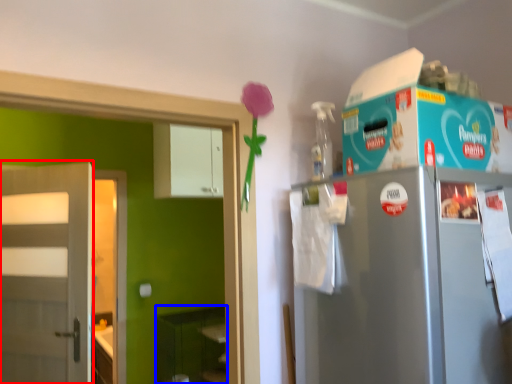
Question: Which object appears farthest to the camera in this image, door (highlighted by a red box) or shelf (highlighted by a blue box)?

Choices:
 (A) door
 (B) shelf

Answer: (B)